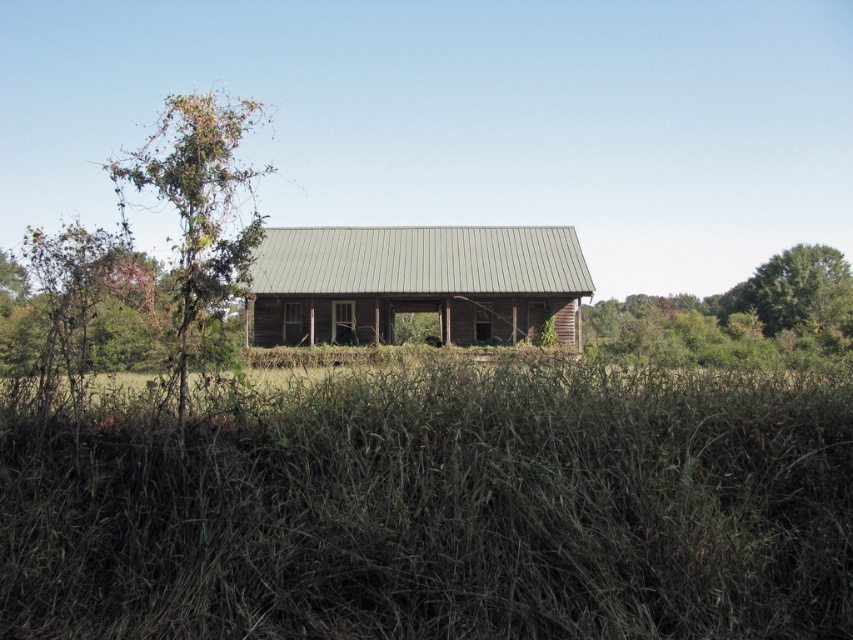
You are a gardener who wants to mow the green rough grass at center and trim the green leafy tree at right. Based on their heights, which task should you tackle first?

The green rough grass at center is shorter than the green leafy tree at right, so you should mow the green rough grass at center first before trimming the taller green leafy tree at right.

You are a gardener who wants to mow the lawn in front of the house. You have a lawnmower that can only handle areas with grass that is not too thick. Based on the image, can you determine which area between the green rough grass at center and the green leafy tree at left would be easier to mow with your lawnmower?

The green rough grass at center is thinner than the green leafy tree at left, so it would be easier to mow the green rough grass at center with your lawnmower since it is less thick.

You are a gardener who wants to mow the lawn in front of the house. You have a lawnmower that can handle vegetation up to 10 cm thick. Based on the image, can you safely mow the green rough grass at center and the green leafy tree at right?

The green rough grass at center is thinner than the green leafy tree at right. Since the lawnmower can handle vegetation up to 10 cm thick, you can safely mow the green rough grass at center. However, the green leafy tree at right may be too thick for the lawnmower to handle, so it should be avoided.